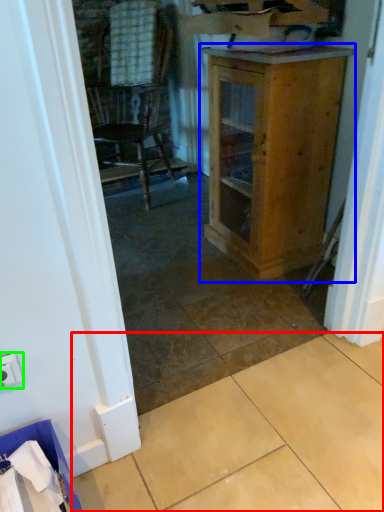
Question: Which object is the farthest from tile (highlighted by a red box)? Choose among these: cabinetry (highlighted by a blue box) or electric outlet (highlighted by a green box).

Choices:
 (A) cabinetry
 (B) electric outlet

Answer: (A)